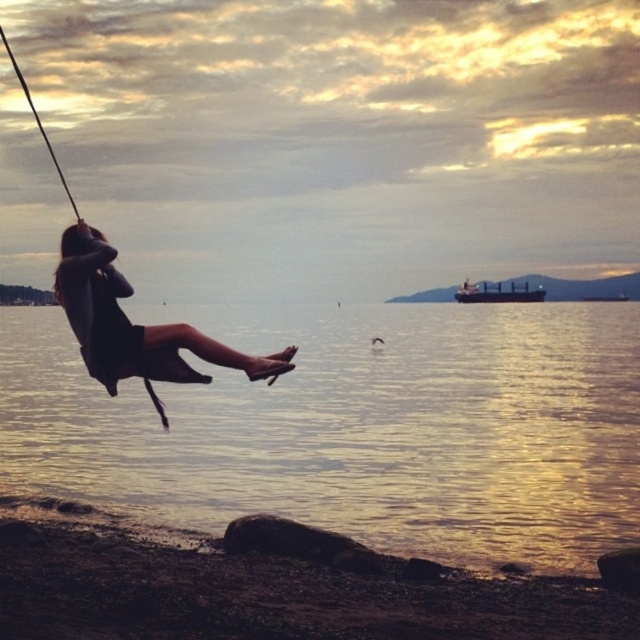
Can you confirm if glistening water at swing right is taller than smooth pebbles at lower left?

Yes.

Does glistening water at swing right have a greater width compared to smooth pebbles at lower left?

Correct, the width of glistening water at swing right exceeds that of smooth pebbles at lower left.

Which is behind, point (579, 502) or point (618, 618)?

Positioned behind is point (579, 502).

Locate an element on the screen. This screenshot has width=640, height=640. glistening water at swing right is located at coordinates (355, 428).

Which of these two, smooth pebbles at lower left or dark matte dress at center, stands shorter?

smooth pebbles at lower left

Which is more to the left, smooth pebbles at lower left or dark matte dress at center?

smooth pebbles at lower left

Is point (36, 536) positioned in front of point (67, 234)?

No, it is behind (67, 234).

You are a GUI agent. You are given a task and a screenshot of the screen. Output one action in this format:
    pyautogui.click(x=<x>, y=<y>)
    Task: Click on the smooth pebbles at lower left
    
    Given the screenshot: What is the action you would take?
    pyautogui.click(x=264, y=589)

Is glistening water at swing right above dark matte dress at center?

Yes.

Can you confirm if glistening water at swing right is taller than dark matte dress at center?

Yes.

Which is behind, point (531, 544) or point (84, 298)?

The point (531, 544) is behind.

Identify the location of glistening water at swing right. (355, 428).